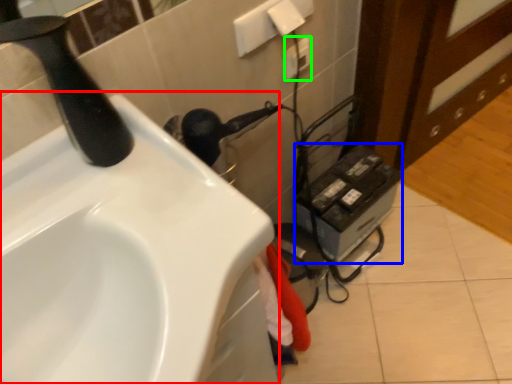
Question: Based on their relative distances, which object is nearer to sink (highlighted by a red box)? Choose from appliance (highlighted by a blue box) and electric outlet (highlighted by a green box).

Choices:
 (A) appliance
 (B) electric outlet

Answer: (A)